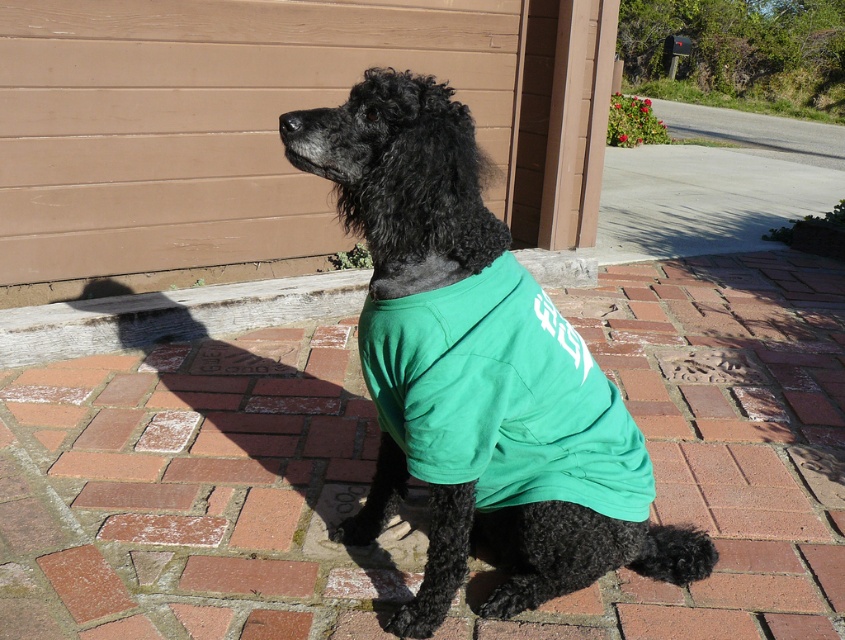
Does shiny black poodle at center appear on the right side of green fabric shirt at center?

In fact, shiny black poodle at center is to the left of green fabric shirt at center.

Can you confirm if shiny black poodle at center is bigger than green fabric shirt at center?

Yes, shiny black poodle at center is bigger than green fabric shirt at center.

Describe the element at coordinates (454, 362) in the screenshot. This screenshot has height=640, width=845. I see `shiny black poodle at center` at that location.

The width and height of the screenshot is (845, 640). What are the coordinates of `shiny black poodle at center` in the screenshot? It's located at (454, 362).